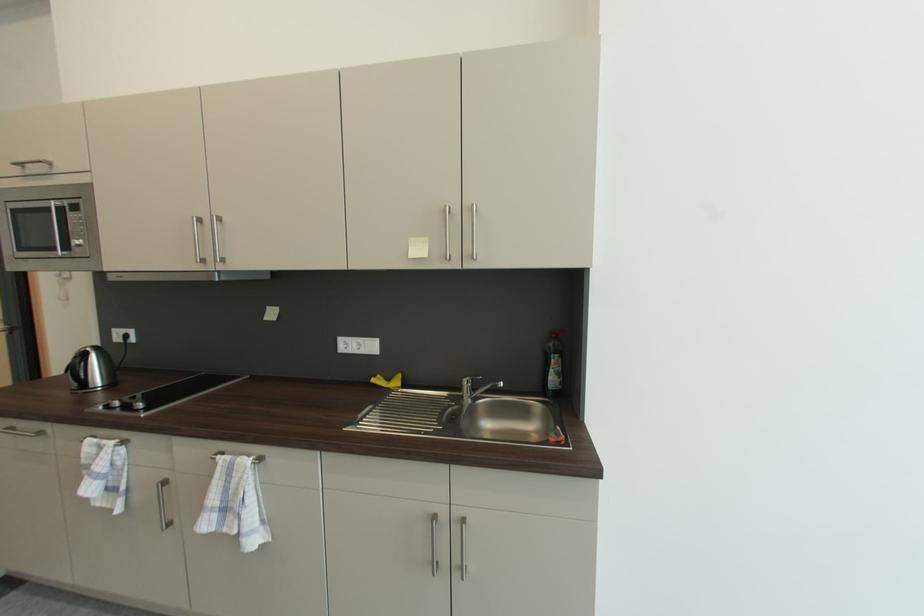
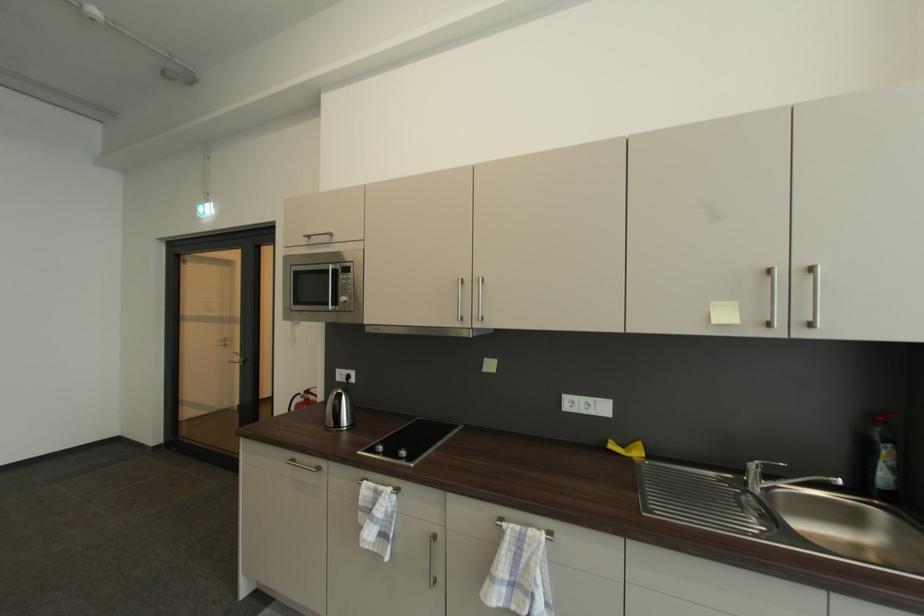
Question: The images are taken continuously from a first-person perspective. In which direction is your viewpoint rotating?

Choices:
 (A) Left
 (B) Right
 (C) Up
 (D) Down

Answer: (A)